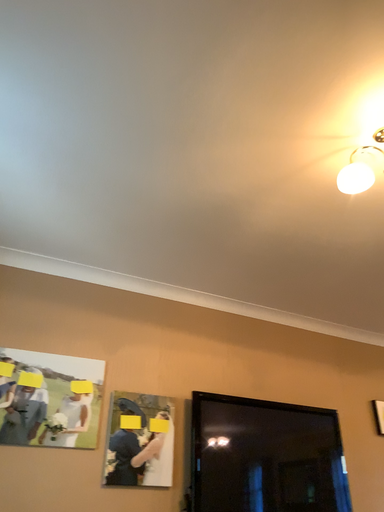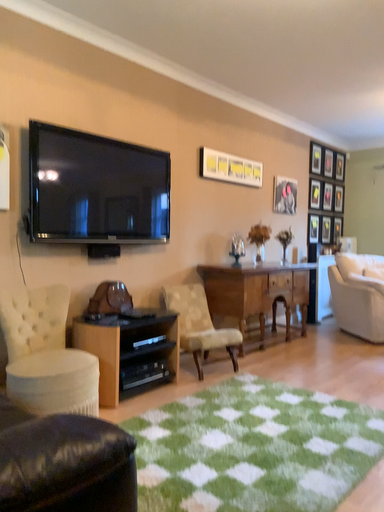
Question: Which way did the camera rotate in the video?

Choices:
 (A) rotated left
 (B) rotated right

Answer: (B)